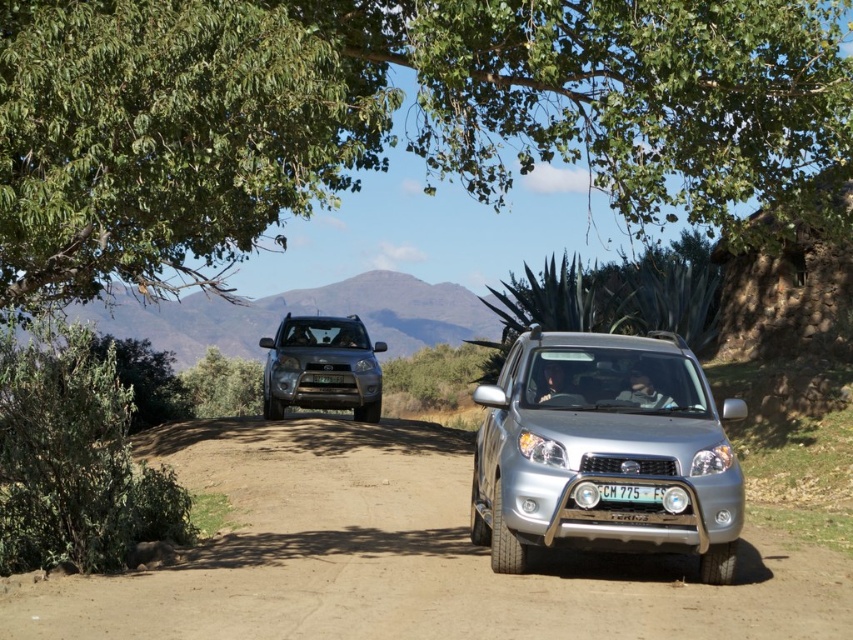
Does silver metallic suv at center have a larger size compared to satin silver suv at center?

Correct, silver metallic suv at center is larger in size than satin silver suv at center.

What do you see at coordinates (604, 451) in the screenshot?
I see `silver metallic suv at center` at bounding box center [604, 451].

Find the location of a particular element. The height and width of the screenshot is (640, 853). silver metallic suv at center is located at coordinates (604, 451).

Does point (49, 152) lie behind point (329, 372)?

No, (49, 152) is closer to viewer.

Does green leafy tree at upper center have a larger size compared to green matte license plate at center?

Yes.

Is point (144, 22) in front of point (314, 378)?

Yes, point (144, 22) is closer to viewer.

Identify the location of green leafy tree at upper center. This screenshot has height=640, width=853. (386, 115).

Is dirt track at center bigger than green leafy bush at lower left?

Yes, dirt track at center is bigger than green leafy bush at lower left.

Is dirt track at center positioned behind green leafy bush at lower left?

No, it is not.

At what (x,y) coordinates should I click in order to perform the action: click on dirt track at center. Please return your answer as a coordinate pair (x, y). The width and height of the screenshot is (853, 640). Looking at the image, I should click on (405, 557).